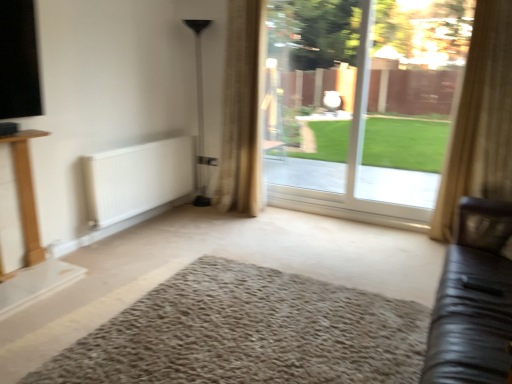
What is the approximate width of transparent glass door at center?

transparent glass door at center is 3.69 inches wide.

What is the approximate width of beige shaggy rug at center?

The width of beige shaggy rug at center is 1.63 meters.

I want to click on beige textured curtain at center, the first curtain viewed from the left, so click(x=243, y=110).

In order to face beige textured curtain at right, placed as the 1th curtain when sorted from front to back, should I rotate leftwards or rightwards?

Rotate right and turn 27.810 degrees.

Find the location of a particular element. The image size is (512, 384). beige textured curtain at right, placed as the 1th curtain when sorted from front to back is located at coordinates (480, 120).

Where is `transparent glass door at center`? The image size is (512, 384). transparent glass door at center is located at coordinates (361, 106).

What's the angular difference between beige textured curtain at center, arranged as the 1th curtain when viewed from the back, and transparent glass door at center's facing directions?

1.38 degrees.

Which object is positioned more to the left, beige textured curtain at center, the first curtain viewed from the left, or transparent glass door at center?

beige textured curtain at center, the first curtain viewed from the left.

This screenshot has width=512, height=384. Find the location of `window directly beneath the beige textured curtain at center, arranged as the 1th curtain when viewed from the back (from a real-world perspective)`. window directly beneath the beige textured curtain at center, arranged as the 1th curtain when viewed from the back (from a real-world perspective) is located at coordinates (361, 106).

Considering the positions of point (249, 68) and point (404, 152), is point (249, 68) closer or farther from the camera than point (404, 152)?

Point (249, 68) is positioned closer to the camera compared to point (404, 152).

Considering the positions of objects beige shaggy rug at center and beige textured curtain at right, acting as the first curtain starting from the right, in the image provided, who is behind, beige shaggy rug at center or beige textured curtain at right, acting as the first curtain starting from the right,?

beige textured curtain at right, acting as the first curtain starting from the right, is behind.

Considering the sizes of beige shaggy rug at center and beige textured curtain at right, placed as the 1th curtain when sorted from front to back, in the image, is beige shaggy rug at center taller or shorter than beige textured curtain at right, placed as the 1th curtain when sorted from front to back,?

In the image, beige shaggy rug at center appears to be shorter than beige textured curtain at right, placed as the 1th curtain when sorted from front to back.

In the scene shown: Considering the relative positions of beige shaggy rug at center and beige textured curtain at right, which ranks as the 2th curtain in left-to-right order, in the image provided, is beige shaggy rug at center to the right of beige textured curtain at right, which ranks as the 2th curtain in left-to-right order, from the viewer's perspective?

Incorrect, beige shaggy rug at center is not on the right side of beige textured curtain at right, which ranks as the 2th curtain in left-to-right order.

From a real-world perspective, is beige textured curtain at right, which is the second curtain in back-to-front order, beneath white matte radiator at lower left?

No.

From the image's perspective, which is above, beige textured curtain at right, which ranks as the 2th curtain in left-to-right order, or white matte radiator at lower left?

beige textured curtain at right, which ranks as the 2th curtain in left-to-right order.

Considering the sizes of objects beige textured curtain at right, acting as the first curtain starting from the right, and white matte radiator at lower left in the image provided, who is taller, beige textured curtain at right, acting as the first curtain starting from the right, or white matte radiator at lower left?

Standing taller between the two is beige textured curtain at right, acting as the first curtain starting from the right.

Looking at their sizes, would you say beige textured curtain at right, which is the second curtain in back-to-front order, is wider or thinner than white matte radiator at lower left?

Considering their sizes, beige textured curtain at right, which is the second curtain in back-to-front order, looks broader than white matte radiator at lower left.

From a real-world perspective, is beige textured curtain at center, acting as the 2th curtain starting from the front, physically below beige textured curtain at right, acting as the first curtain starting from the right?

No.

From the picture: Is beige textured curtain at center, arranged as the 1th curtain when viewed from the back, at the left side of beige textured curtain at right, which is the second curtain in back-to-front order?

Correct, you'll find beige textured curtain at center, arranged as the 1th curtain when viewed from the back, to the left of beige textured curtain at right, which is the second curtain in back-to-front order.

Can we say beige textured curtain at center, the first curtain viewed from the left, lies outside beige textured curtain at right, placed as the 1th curtain when sorted from front to back?

Yes, beige textured curtain at center, the first curtain viewed from the left, is located beyond the bounds of beige textured curtain at right, placed as the 1th curtain when sorted from front to back.

Between black leather couch at right and white matte radiator at lower left, which one has larger width?

With larger width is black leather couch at right.

Is black leather couch at right turned away from white matte radiator at lower left?

black leather couch at right does not have its back to white matte radiator at lower left.

Which is behind, black leather couch at right or white matte radiator at lower left?

white matte radiator at lower left is behind.

Which of these two, black leather couch at right or white matte radiator at lower left, is bigger?

With larger size is black leather couch at right.

What's the angular difference between metallic silver lamp at center and white matte radiator at lower left's facing directions?

They differ by 91.1 degrees in their facing directions.

From a real-world perspective, which is physically above, metallic silver lamp at center or white matte radiator at lower left?

From a 3D spatial view, metallic silver lamp at center is above.

Does metallic silver lamp at center have a lesser height compared to white matte radiator at lower left?

Incorrect, the height of metallic silver lamp at center does not fall short of that of white matte radiator at lower left.

Is white matte radiator at lower left bigger or smaller than metallic silver lamp at center?

Clearly, white matte radiator at lower left is larger in size than metallic silver lamp at center.

From a real-world perspective, is white matte radiator at lower left beneath metallic silver lamp at center?

Yes, from a real-world perspective, white matte radiator at lower left is beneath metallic silver lamp at center.

Does white matte radiator at lower left come behind metallic silver lamp at center?

No, the depth of white matte radiator at lower left is less than that of metallic silver lamp at center.

Is metallic silver lamp at center located within white matte radiator at lower left?

No, white matte radiator at lower left does not contain metallic silver lamp at center.

Identify the location of window in front of the beige textured curtain at center, the first curtain viewed from the left. The width and height of the screenshot is (512, 384). (361, 106).

This screenshot has width=512, height=384. Identify the location of plain on the left of the beige textured curtain at right, which ranks as the 2th curtain in left-to-right order. (248, 333).

When comparing their distances from transparent glass door at center, does beige shaggy rug at center or beige textured curtain at right, which ranks as the 2th curtain in left-to-right order, seem further?

Based on the image, beige shaggy rug at center appears to be further to transparent glass door at center.

Based on the photo, estimate the real-world distances between objects in this image. Which object is closer to black leather couch at right, white matte radiator at lower left or transparent glass door at center?

transparent glass door at center.

Which object lies further to the anchor point beige shaggy rug at center, black leather couch at right or transparent glass door at center?

The object further to beige shaggy rug at center is transparent glass door at center.

When comparing their distances from beige textured curtain at right, which is the second curtain in back-to-front order, does beige shaggy rug at center or transparent glass door at center seem further?

beige shaggy rug at center.

From the image, which object appears to be farther from black leather couch at right, beige shaggy rug at center or transparent glass door at center?

Based on the image, transparent glass door at center appears to be further to black leather couch at right.

Looking at the image, which one is located closer to beige shaggy rug at center, transparent glass door at center or white matte radiator at lower left?

white matte radiator at lower left is positioned closer to the anchor beige shaggy rug at center.

From the image, which object appears to be nearer to black leather couch at right, beige textured curtain at center, acting as the 2th curtain starting from the front, or transparent glass door at center?

beige textured curtain at center, acting as the 2th curtain starting from the front.

Looking at this image, which object lies further to the anchor point beige textured curtain at right, which is the second curtain in back-to-front order, beige textured curtain at center, acting as the 2th curtain starting from the front, or beige shaggy rug at center?

beige textured curtain at center, acting as the 2th curtain starting from the front.

In order to click on curtain located between white matte radiator at lower left and transparent glass door at center in the left-right direction in this screenshot , I will do `click(243, 110)`.

Image resolution: width=512 pixels, height=384 pixels. Identify the location of plain located between black leather couch at right and metallic silver lamp at center in the depth direction. (248, 333).

Where is `lamp situated between white matte radiator at lower left and beige textured curtain at center, arranged as the 1th curtain when viewed from the back, from left to right`? lamp situated between white matte radiator at lower left and beige textured curtain at center, arranged as the 1th curtain when viewed from the back, from left to right is located at coordinates (200, 113).

Identify the location of curtain between beige shaggy rug at center and transparent glass door at center in the front-back direction. (480, 120).